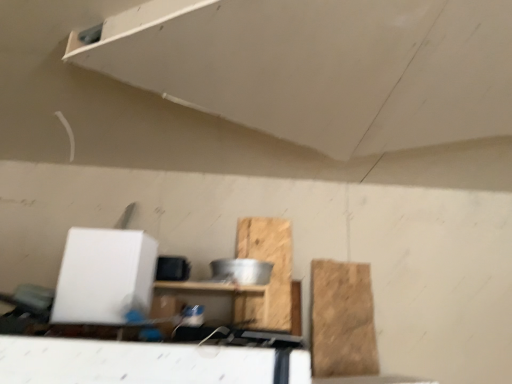
Where is `brown cardboard at right, which is counted as the 1th cardboard, starting from the right`? This screenshot has height=384, width=512. brown cardboard at right, which is counted as the 1th cardboard, starting from the right is located at coordinates (342, 320).

This screenshot has height=384, width=512. What do you see at coordinates (322, 67) in the screenshot?
I see `white matte exhaust hood at upper center` at bounding box center [322, 67].

This screenshot has height=384, width=512. What are the coordinates of `wooden at center, which appears as the 1th cardboard when viewed from the left` in the screenshot? It's located at point(271,273).

The height and width of the screenshot is (384, 512). Find the location of `wooden shelf at center`. wooden shelf at center is located at coordinates (216, 288).

This screenshot has width=512, height=384. In order to click on brown cardboard at right, which is counted as the 1th cardboard, starting from the right in this screenshot , I will do `click(342, 320)`.

Is wooden shelf at center at the right side of wooden at center, which is counted as the second cardboard, starting from the right?

No, wooden shelf at center is not to the right of wooden at center, which is counted as the second cardboard, starting from the right.

Can you confirm if wooden shelf at center is shorter than wooden at center, which is counted as the second cardboard, starting from the right?

Indeed, wooden shelf at center has a lesser height compared to wooden at center, which is counted as the second cardboard, starting from the right.

What's the angular difference between wooden shelf at center and wooden at center, which is counted as the second cardboard, starting from the right,'s facing directions?

The angular difference between wooden shelf at center and wooden at center, which is counted as the second cardboard, starting from the right, is 180 degrees.

From a real-world perspective, relative to brown cardboard at right, which is counted as the 1th cardboard, starting from the right, is wooden shelf at center vertically above or below?

Clearly, from a real-world perspective, wooden shelf at center is below brown cardboard at right, which is counted as the 1th cardboard, starting from the right.

Identify the location of furniture on the left of brown cardboard at right, which is counted as the 1th cardboard, starting from the right. The width and height of the screenshot is (512, 384). (216, 288).

Do you think wooden shelf at center is within brown cardboard at right, which is counted as the 1th cardboard, starting from the right, or outside of it?

wooden shelf at center is not inside brown cardboard at right, which is counted as the 1th cardboard, starting from the right, it's outside.

Can you tell me how much wooden shelf at center and brown cardboard at right, which is counted as the 1th cardboard, starting from the right, differ in facing direction?

177 degrees separate the facing orientations of wooden shelf at center and brown cardboard at right, which is counted as the 1th cardboard, starting from the right.

Who is bigger, wooden at center, which is counted as the second cardboard, starting from the right, or brown cardboard at right, which is counted as the 1th cardboard, starting from the right?

Answer: wooden at center, which is counted as the second cardboard, starting from the right.

Which is behind, wooden at center, which appears as the 1th cardboard when viewed from the left, or brown cardboard at right, which appears as the second cardboard when viewed from the left?

wooden at center, which appears as the 1th cardboard when viewed from the left.

Image resolution: width=512 pixels, height=384 pixels. In order to click on cardboard that is below the wooden at center, which appears as the 1th cardboard when viewed from the left (from the image's perspective) in this screenshot , I will do [x=342, y=320].

Is wooden at center, which appears as the 1th cardboard when viewed from the left, looking in the opposite direction of brown cardboard at right, which appears as the second cardboard when viewed from the left?

wooden at center, which appears as the 1th cardboard when viewed from the left, does not have its back to brown cardboard at right, which appears as the second cardboard when viewed from the left.

Considering the sizes of objects white matte exhaust hood at upper center and wooden shelf at center in the image provided, who is taller, white matte exhaust hood at upper center or wooden shelf at center?

wooden shelf at center is taller.

Which is in front, point (413, 55) or point (238, 289)?

Positioned in front is point (413, 55).

Find the location of `the 1st cardboard below the white matte exhaust hood at upper center (from the image's perspective)`. the 1st cardboard below the white matte exhaust hood at upper center (from the image's perspective) is located at coordinates (271, 273).

Can you confirm if wooden at center, which is counted as the second cardboard, starting from the right, is taller than white matte exhaust hood at upper center?

Yes.

How many degrees apart are the facing directions of wooden at center, which is counted as the second cardboard, starting from the right, and white matte exhaust hood at upper center?

They differ by 29.3 degrees in their facing directions.

Which of these two, wooden at center, which appears as the 1th cardboard when viewed from the left, or white matte exhaust hood at upper center, is thinner?

Thinner between the two is wooden at center, which appears as the 1th cardboard when viewed from the left.

Can white matte exhaust hood at upper center be found inside brown cardboard at right, which appears as the second cardboard when viewed from the left?

Actually, white matte exhaust hood at upper center is outside brown cardboard at right, which appears as the second cardboard when viewed from the left.

Which is more to the right, brown cardboard at right, which is counted as the 1th cardboard, starting from the right, or white matte exhaust hood at upper center?

brown cardboard at right, which is counted as the 1th cardboard, starting from the right.

From the image's perspective, between brown cardboard at right, which is counted as the 1th cardboard, starting from the right, and white matte exhaust hood at upper center, who is located below?

From the image's view, brown cardboard at right, which is counted as the 1th cardboard, starting from the right, is below.

Is brown cardboard at right, which is counted as the 1th cardboard, starting from the right, looking in the opposite direction of white matte exhaust hood at upper center?

No, brown cardboard at right, which is counted as the 1th cardboard, starting from the right, is not facing away from white matte exhaust hood at upper center.

From the image's perspective, does brown cardboard at right, which appears as the second cardboard when viewed from the left, appear higher than wooden shelf at center?

Actually, brown cardboard at right, which appears as the second cardboard when viewed from the left, appears below wooden shelf at center in the image.

Is brown cardboard at right, which is counted as the 1th cardboard, starting from the right, taller than wooden shelf at center?

Yes, brown cardboard at right, which is counted as the 1th cardboard, starting from the right, is taller than wooden shelf at center.

From a real-world perspective, who is located higher, brown cardboard at right, which appears as the second cardboard when viewed from the left, or wooden shelf at center?

brown cardboard at right, which appears as the second cardboard when viewed from the left, from a real-world perspective.

Find the location of a particular element. This screenshot has width=512, height=384. furniture in front of the wooden at center, which is counted as the second cardboard, starting from the right is located at coordinates (216, 288).

At what (x,y) coordinates should I click in order to perform the action: click on furniture below the brown cardboard at right, which is counted as the 1th cardboard, starting from the right (from a real-world perspective). Please return your answer as a coordinate pair (x, y). The image size is (512, 384). Looking at the image, I should click on (216, 288).

Looking at the image, which one is located further to wooden at center, which is counted as the second cardboard, starting from the right, brown cardboard at right, which appears as the second cardboard when viewed from the left, or white matte exhaust hood at upper center?

Among the two, white matte exhaust hood at upper center is located further to wooden at center, which is counted as the second cardboard, starting from the right.

From the image, which object appears to be farther from white matte exhaust hood at upper center, wooden shelf at center or wooden at center, which appears as the 1th cardboard when viewed from the left?

wooden at center, which appears as the 1th cardboard when viewed from the left, lies further to white matte exhaust hood at upper center than the other object.

Looking at the image, which one is located further to wooden shelf at center, brown cardboard at right, which appears as the second cardboard when viewed from the left, or white matte exhaust hood at upper center?

Based on the image, white matte exhaust hood at upper center appears to be further to wooden shelf at center.

When comparing their distances from brown cardboard at right, which is counted as the 1th cardboard, starting from the right, does wooden at center, which appears as the 1th cardboard when viewed from the left, or white matte exhaust hood at upper center seem further?

Based on the image, white matte exhaust hood at upper center appears to be further to brown cardboard at right, which is counted as the 1th cardboard, starting from the right.

Estimate the real-world distances between objects in this image. Which object is closer to brown cardboard at right, which appears as the second cardboard when viewed from the left, white matte exhaust hood at upper center or wooden shelf at center?

Based on the image, wooden shelf at center appears to be nearer to brown cardboard at right, which appears as the second cardboard when viewed from the left.

Which object lies nearer to the anchor point white matte exhaust hood at upper center, brown cardboard at right, which appears as the second cardboard when viewed from the left, or wooden shelf at center?

Among the two, wooden shelf at center is located nearer to white matte exhaust hood at upper center.

Estimate the real-world distances between objects in this image. Which object is further from brown cardboard at right, which appears as the second cardboard when viewed from the left, wooden at center, which is counted as the second cardboard, starting from the right, or wooden shelf at center?

wooden shelf at center is further to brown cardboard at right, which appears as the second cardboard when viewed from the left.

Looking at the image, which one is located closer to wooden at center, which appears as the 1th cardboard when viewed from the left, white matte exhaust hood at upper center or brown cardboard at right, which appears as the second cardboard when viewed from the left?

The object closer to wooden at center, which appears as the 1th cardboard when viewed from the left, is brown cardboard at right, which appears as the second cardboard when viewed from the left.

At what (x,y) coordinates should I click in order to perform the action: click on furniture between white matte exhaust hood at upper center and wooden at center, which is counted as the second cardboard, starting from the right, in the front-back direction. Please return your answer as a coordinate pair (x, y). Looking at the image, I should click on (216, 288).

Where is `cardboard between wooden shelf at center and brown cardboard at right, which is counted as the 1th cardboard, starting from the right`? cardboard between wooden shelf at center and brown cardboard at right, which is counted as the 1th cardboard, starting from the right is located at coordinates (271, 273).

Where is `cardboard positioned between white matte exhaust hood at upper center and wooden at center, which appears as the 1th cardboard when viewed from the left, from near to far`? cardboard positioned between white matte exhaust hood at upper center and wooden at center, which appears as the 1th cardboard when viewed from the left, from near to far is located at coordinates (342, 320).

Find the location of `furniture between white matte exhaust hood at upper center and brown cardboard at right, which appears as the second cardboard when viewed from the left, along the z-axis`. furniture between white matte exhaust hood at upper center and brown cardboard at right, which appears as the second cardboard when viewed from the left, along the z-axis is located at coordinates (216, 288).